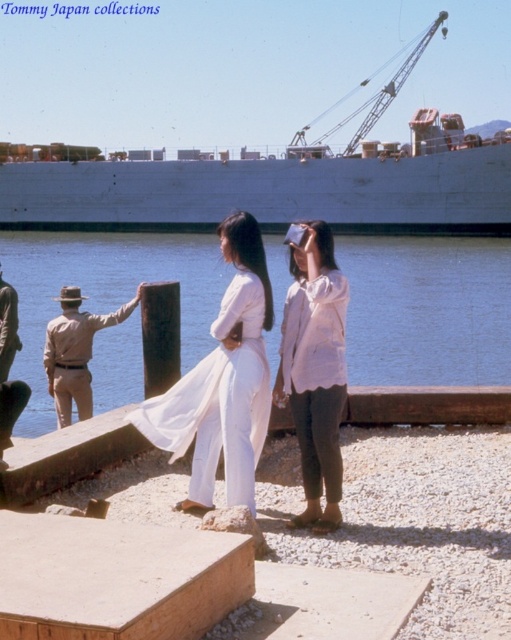
You are standing at the dock and see the blue water at center and the light beige cotton shirt at center. Which object is positioned to the right of the other?

The blue water at center is to the right of the light beige cotton shirt at center.